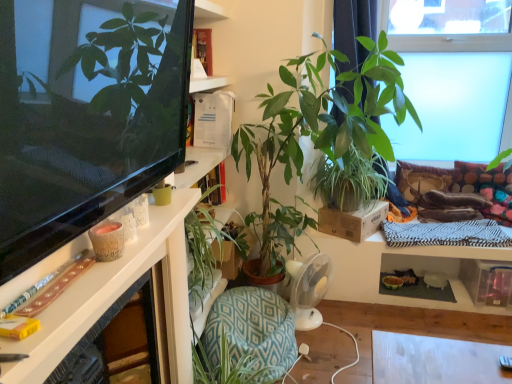
Question: Should I look upward or downward to see green leafy plant at upper right, placed as the 4th houseplant when sorted from left to right?

Choices:
 (A) down
 (B) up

Answer: (B)

Question: From a real-world perspective, is transparent glass window at upper right positioned over velvet brown pillow at upper right, acting as the first pillow starting from the left, based on gravity?

Choices:
 (A) yes
 (B) no

Answer: (A)

Question: Is transparent glass window at upper right positioned far away from velvet brown pillow at upper right, the 2th pillow positioned from the right?

Choices:
 (A) no
 (B) yes

Answer: (A)

Question: Are transparent glass window at upper right and velvet brown pillow at upper right, acting as the first pillow starting from the left, beside each other?

Choices:
 (A) yes
 (B) no

Answer: (B)

Question: Is transparent glass window at upper right taller than velvet brown pillow at upper right, acting as the first pillow starting from the left?

Choices:
 (A) no
 (B) yes

Answer: (B)

Question: Can you confirm if transparent glass window at upper right is smaller than velvet brown pillow at upper right, the 2th pillow positioned from the right?

Choices:
 (A) yes
 (B) no

Answer: (B)

Question: Is transparent glass window at upper right to the right of velvet brown pillow at upper right, the 2th pillow positioned from the right, from the viewer's perspective?

Choices:
 (A) no
 (B) yes

Answer: (B)

Question: Considering the relative sizes of multicolored fabric pillow at right, the first pillow positioned from the right, and white glossy desk at left in the image provided, is multicolored fabric pillow at right, the first pillow positioned from the right, bigger than white glossy desk at left?

Choices:
 (A) yes
 (B) no

Answer: (A)

Question: Does multicolored fabric pillow at right, placed as the 2th pillow when sorted from left to right, have a lesser height compared to white glossy desk at left?

Choices:
 (A) yes
 (B) no

Answer: (B)

Question: From a real-world perspective, is multicolored fabric pillow at right, the first pillow positioned from the right, under white glossy desk at left?

Choices:
 (A) no
 (B) yes

Answer: (B)

Question: From a real-world perspective, is multicolored fabric pillow at right, placed as the 2th pillow when sorted from left to right, on top of white glossy desk at left?

Choices:
 (A) no
 (B) yes

Answer: (A)

Question: Is multicolored fabric pillow at right, placed as the 2th pillow when sorted from left to right, further to camera compared to white glossy desk at left?

Choices:
 (A) yes
 (B) no

Answer: (A)

Question: Is multicolored fabric pillow at right, the first pillow positioned from the right, outside white glossy desk at left?

Choices:
 (A) no
 (B) yes

Answer: (B)

Question: From the image's perspective, does transparent glass window at upper right appear lower than green leafy plant at center, acting as the 1th houseplant starting from the left?

Choices:
 (A) no
 (B) yes

Answer: (A)